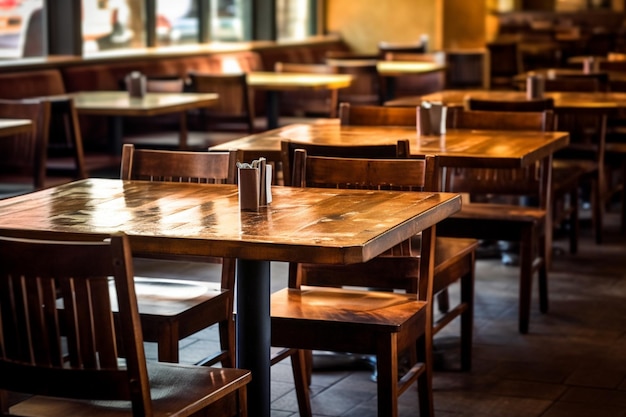
Find the location of a particular element. Image resolution: width=626 pixels, height=417 pixels. table is located at coordinates (171, 229), (375, 138), (476, 91), (131, 104), (8, 122), (285, 86), (411, 69).